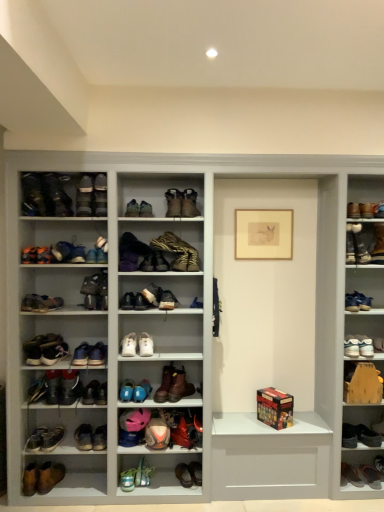
Identify the location of vacant region to the right of green suede sneakers at lower center, which ranks as the 19th footwear in right-to-left order. (173, 487).